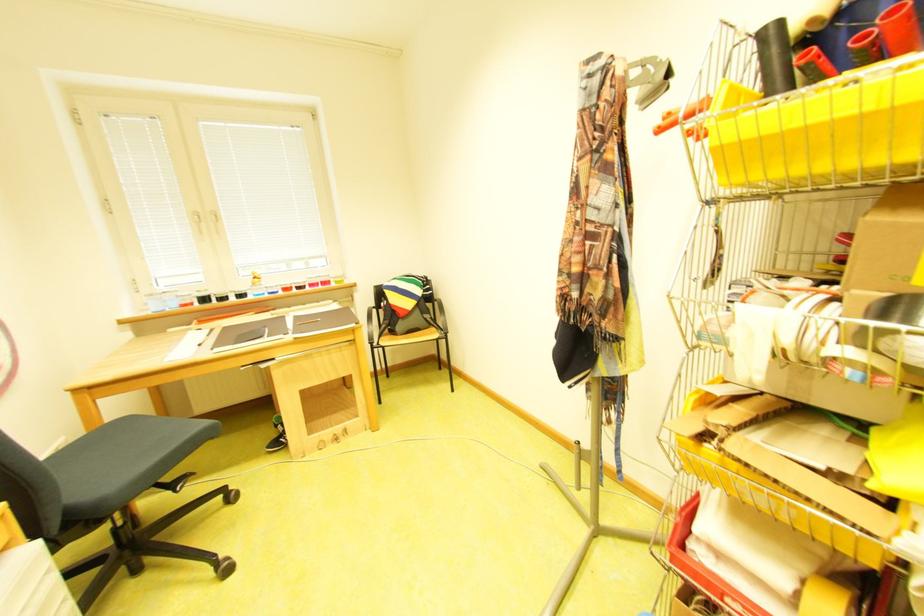
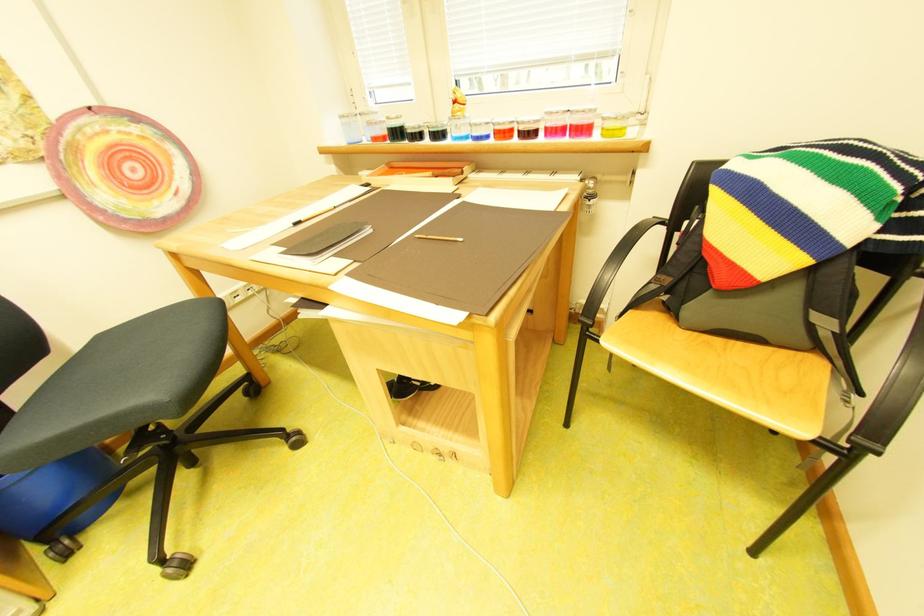
The point at [264,314] is marked in the first image. Where is the corresponding point in the second image?

(441, 175)